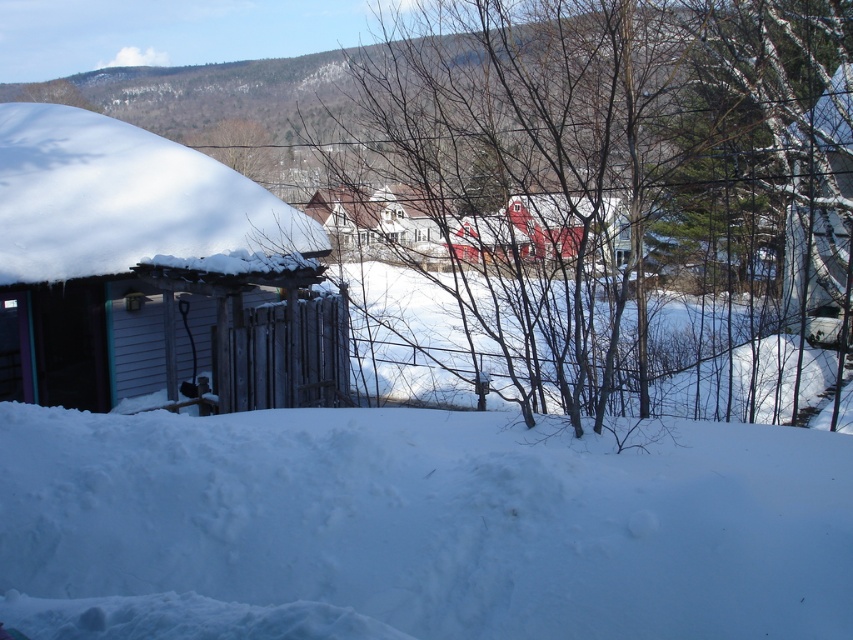
Question: Which point appears farthest from the camera in this image?

Choices:
 (A) pyautogui.click(x=338, y=397)
 (B) pyautogui.click(x=502, y=243)

Answer: (A)

Question: Does white wooden house at center have a greater width compared to bare wood tree at upper center?

Choices:
 (A) no
 (B) yes

Answer: (B)

Question: Which point is farther to the camera?

Choices:
 (A) white fluffy snow at lower center
 (B) red matte barn at center
 (C) bare wood tree at upper center

Answer: (C)

Question: Does wooden shed at left appear under red matte barn at center?

Choices:
 (A) no
 (B) yes

Answer: (B)

Question: Is bare branches at center further to camera compared to white wooden house at center?

Choices:
 (A) yes
 (B) no

Answer: (B)

Question: Which point is closer to the camera?

Choices:
 (A) (358, 145)
 (B) (242, 179)
 (C) (519, 500)

Answer: (C)